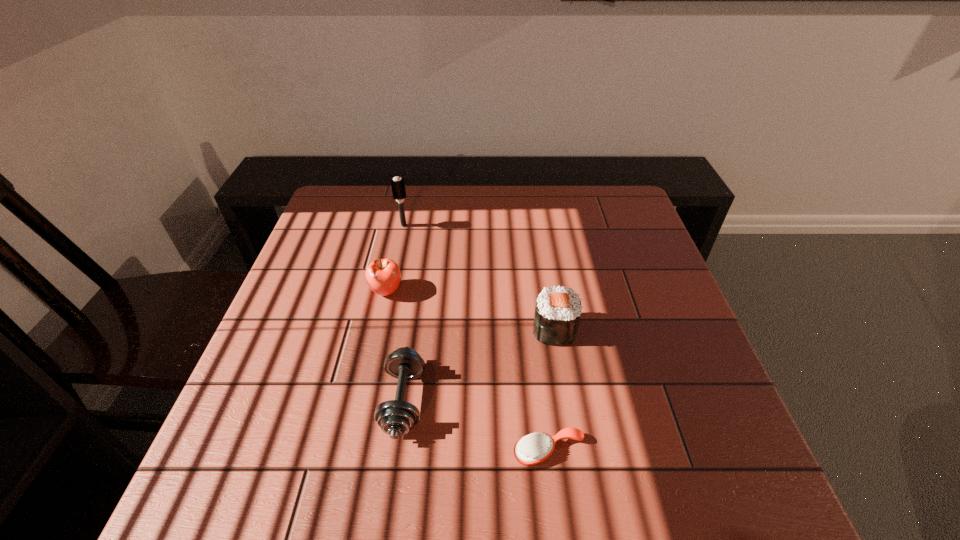
Where is `free point located on the left of the dumbbell`? This screenshot has height=540, width=960. free point located on the left of the dumbbell is located at coordinates (279, 401).

Image resolution: width=960 pixels, height=540 pixels. In order to click on free space located on the left of the right hairbrush in this screenshot , I will do `click(329, 451)`.

The image size is (960, 540). In order to click on object situated at the far edge in this screenshot , I will do `click(398, 188)`.

You are a GUI agent. You are given a task and a screenshot of the screen. Output one action in this format:
    pyautogui.click(x=<x>, y=<y>)
    Task: Click on the object present at the near edge
    The height and width of the screenshot is (540, 960).
    Given the screenshot: What is the action you would take?
    pyautogui.click(x=534, y=448)

Identify the location of vacant space at the far edge. (440, 187).

The image size is (960, 540). In the image, there is a desktop. Find the location of `vacant space at the near edge`. vacant space at the near edge is located at coordinates (446, 461).

This screenshot has width=960, height=540. Identify the location of free space at the left edge of the desktop. (323, 382).

You are a GUI agent. You are given a task and a screenshot of the screen. Output one action in this format:
    pyautogui.click(x=<x>, y=<y>)
    Task: Click on the free region at the right edge of the desktop
    
    Given the screenshot: What is the action you would take?
    pyautogui.click(x=644, y=254)

The width and height of the screenshot is (960, 540). In order to click on vacant space at the far left corner of the desktop in this screenshot , I will do `click(377, 202)`.

Image resolution: width=960 pixels, height=540 pixels. In the image, there is a desktop. Identify the location of vacant space at the far right corner. (588, 194).